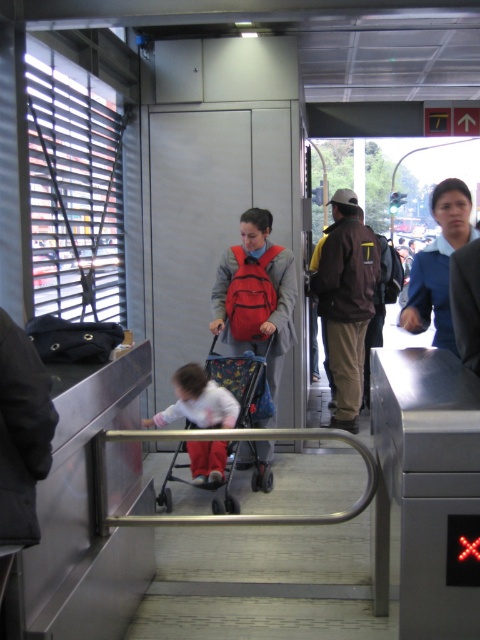
You are standing at the subway station and want to know which of the two points, point (x=348, y=188) or point (x=214, y=356), is closer to you. Based on the scene, can you determine this?

Point (x=348, y=188) is further to the viewer than point (x=214, y=356), so the closer point is point (x=214, y=356).

You are standing at the entrance of the subway station and see two points marked on the floor. The first point is at coordinate point (x=279, y=298) and the second is at coordinate point (x=180, y=480). If you want to walk towards the second point, which direction should you move relative to the first point?

To move towards the second point at coordinate point (x=180, y=480) from the first point at coordinate point (x=279, y=298), you should move northeast. This is because the second point has a higher x coordinate and lower y coordinate compared to the first point, indicating a northeast direction.